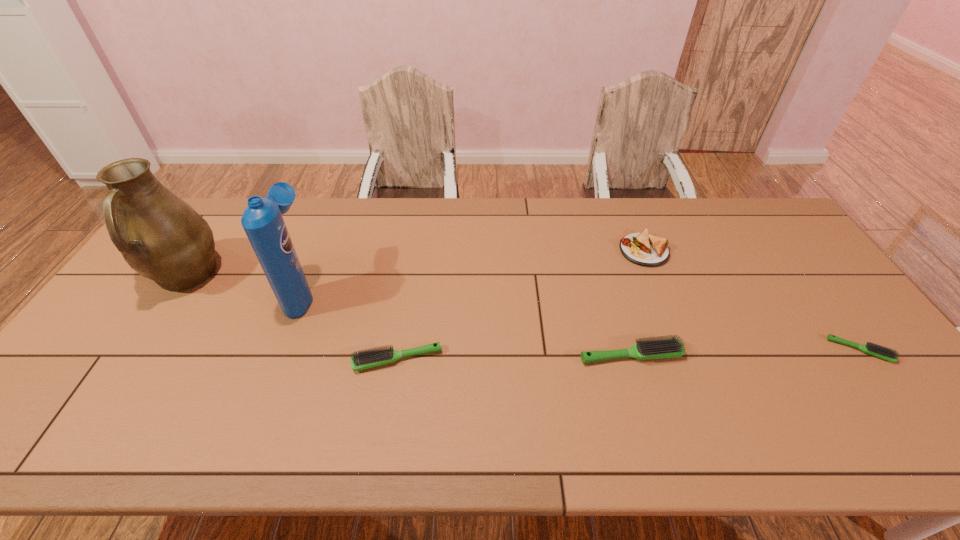
Identify the location of vacant space at the right edge. (805, 316).

In the image, there is a desktop. What are the coordinates of `vacant space at the far left corner` in the screenshot? It's located at tap(237, 203).

I want to click on vacant position at the near left corner of the desktop, so click(72, 386).

Where is `free space that is in between the fifth object from right to left and the leftmost object`? This screenshot has width=960, height=540. free space that is in between the fifth object from right to left and the leftmost object is located at coordinates (245, 285).

The height and width of the screenshot is (540, 960). In order to click on vacant space that's between the second shortest hairbrush and the sandwich in this screenshot , I will do `click(520, 305)`.

Locate an element on the screen. vacant area between the second shortest hairbrush and the second hairbrush from right to left is located at coordinates pyautogui.click(x=514, y=357).

Where is `free space between the shortest object and the sandwich`? This screenshot has width=960, height=540. free space between the shortest object and the sandwich is located at coordinates (752, 301).

The image size is (960, 540). What are the coordinates of `free spot between the second hairbrush from right to left and the shampoo` in the screenshot? It's located at (467, 323).

I want to click on free spot between the leftmost hairbrush and the shampoo, so click(x=350, y=326).

At what (x,y) coordinates should I click in order to perform the action: click on empty space between the second hairbrush from right to left and the rightmost hairbrush. Please return your answer as a coordinate pair (x, y). Looking at the image, I should click on (745, 353).